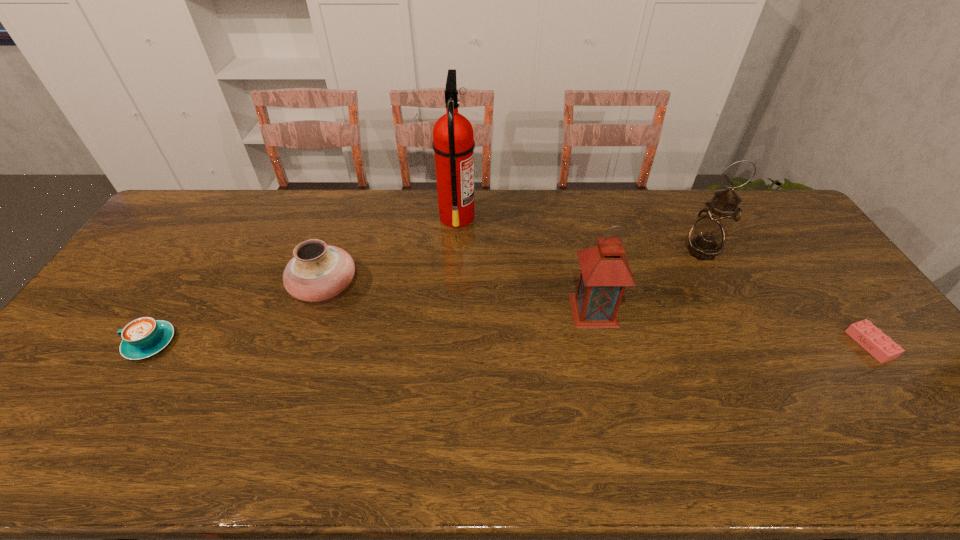
In order to click on vacant region that satisfies the following two spatial constraints: 1. on the back side of the Lego; 2. on the side of the farthest object near the handle in this screenshot , I will do `click(775, 217)`.

Where is `vacant space that satisfies the following two spatial constraints: 1. on the side of the fourth object from left to right near the handle; 2. on the left side of the fire extinguisher`? This screenshot has height=540, width=960. vacant space that satisfies the following two spatial constraints: 1. on the side of the fourth object from left to right near the handle; 2. on the left side of the fire extinguisher is located at coordinates (451, 310).

At what (x,y) coordinates should I click in order to perform the action: click on blank area in the image that satisfies the following two spatial constraints: 1. with the handle on the right side of the Lego; 2. on the right side of the cappuccino. Please return your answer as a coordinate pair (x, y). Image resolution: width=960 pixels, height=540 pixels. Looking at the image, I should click on (150, 345).